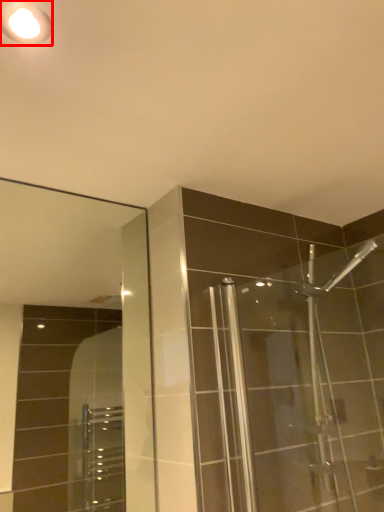
Question: Observing the image, what is the correct spatial positioning of light fixture (annotated by the red box) in reference to mirror?

Choices:
 (A) right
 (B) left

Answer: (A)